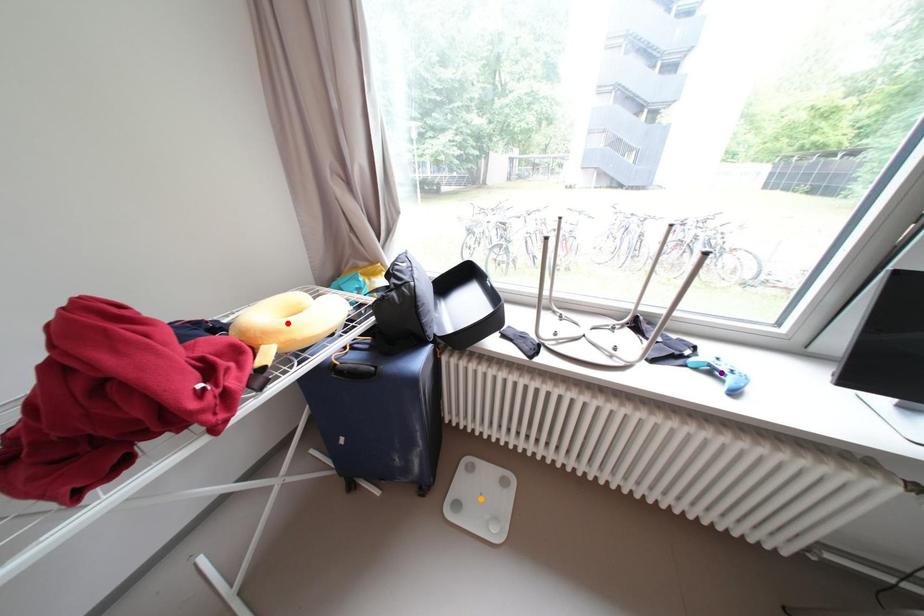
Order these from farthest to nearest:
1. purple point
2. orange point
3. red point

orange point → purple point → red point